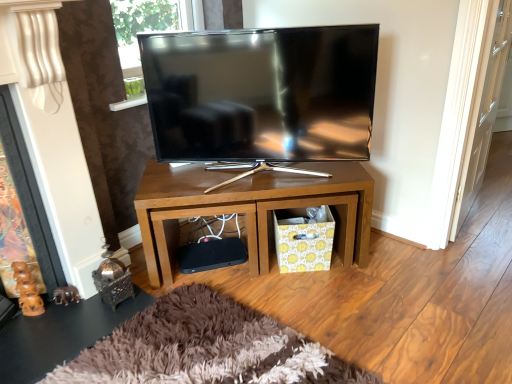
You are a GUI agent. You are given a task and a screenshot of the screen. Output one action in this format:
    pyautogui.click(x=<x>, y=<y>)
    Task: Click on the vacant area located to the right-hand side of wooden tv stand at center
    This screenshot has width=512, height=384.
    Given the screenshot: What is the action you would take?
    pyautogui.click(x=414, y=286)